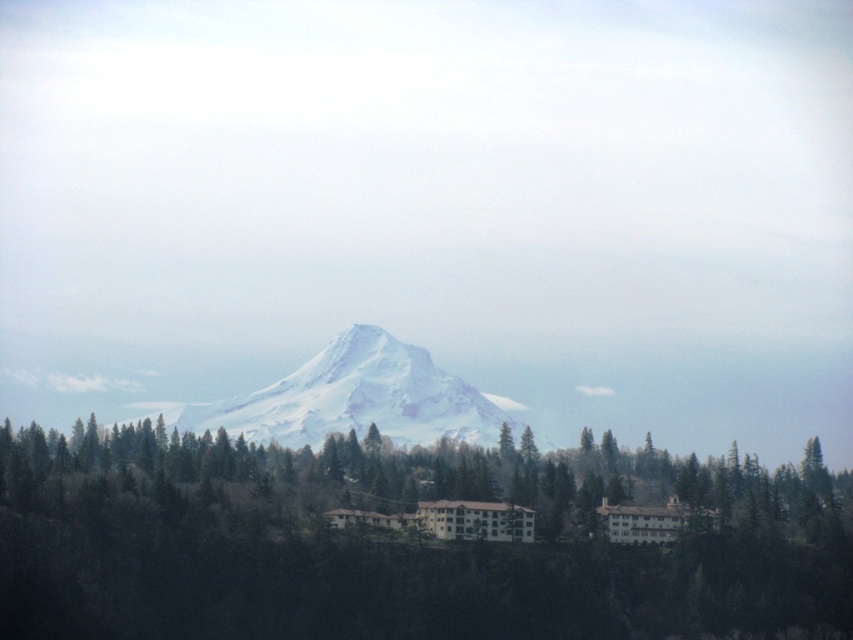
Question: Is green matte trees at center in front of white snow-covered mountain at center?

Choices:
 (A) no
 (B) yes

Answer: (B)

Question: Which point is farther to the camera?

Choices:
 (A) (271, 422)
 (B) (190, 477)

Answer: (A)

Question: Which of the following is the closest to the observer?

Choices:
 (A) (223, 598)
 (B) (413, 365)

Answer: (A)

Question: In this image, where is green matte trees at center located relative to white snow-covered mountain at center?

Choices:
 (A) above
 (B) below

Answer: (B)

Question: Does green matte trees at center appear on the left side of white snow-covered mountain at center?

Choices:
 (A) no
 (B) yes

Answer: (A)